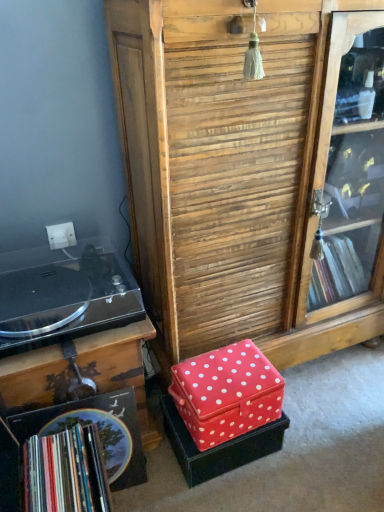
I want to click on vacant region above red fabric box at lower center, which is the 1th storage box from top to bottom (from a real-world perspective), so click(221, 373).